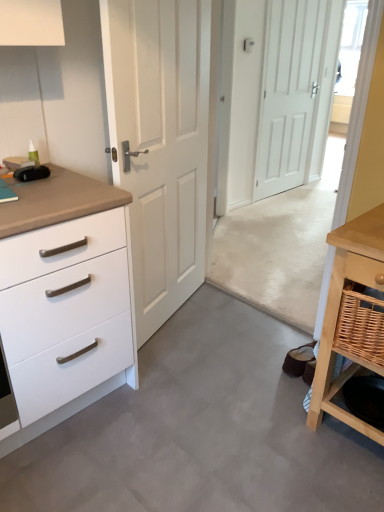
Identify the location of vacant area that is in front of white matte door at center, placed as the 2th door when sorted from right to left. This screenshot has height=512, width=384. (200, 369).